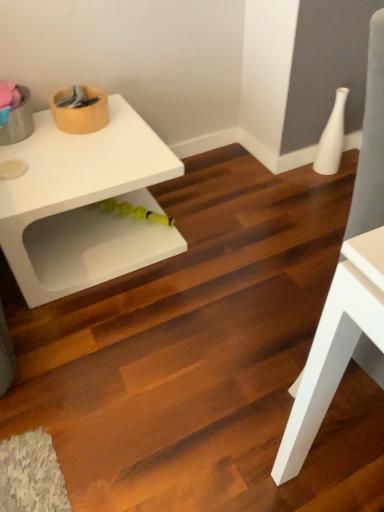
Locate an element on the screen. This screenshot has height=512, width=384. white matte table at right, the second table in the back-to-front sequence is located at coordinates (335, 345).

This screenshot has width=384, height=512. What do you see at coordinates (335, 345) in the screenshot?
I see `white matte table at right, placed as the first table when sorted from front to back` at bounding box center [335, 345].

Locate an element on the screen. The image size is (384, 512). white matte table at right, placed as the first table when sorted from front to back is located at coordinates (335, 345).

Is white glossy vase at upper right wider or thinner than white matte table at right, the second table in the back-to-front sequence?

Clearly, white glossy vase at upper right has less width compared to white matte table at right, the second table in the back-to-front sequence.

Considering the positions of points (333, 119) and (334, 281), is point (333, 119) closer to camera compared to point (334, 281)?

No, it is not.

Can you confirm if white glossy vase at upper right is taller than white matte table at right, the second table in the back-to-front sequence?

Incorrect, the height of white glossy vase at upper right is not larger of that of white matte table at right, the second table in the back-to-front sequence.

Find the location of a particular element. The width and height of the screenshot is (384, 512). table below the white matte table at upper left, the second table when ordered from front to back (from the image's perspective) is located at coordinates (335, 345).

In the image, is white matte table at right, which ranks as the first table in right-to-left order, on the left side or the right side of white matte table at upper left, positioned as the 1th table in back-to-front order?

In the image, white matte table at right, which ranks as the first table in right-to-left order, appears on the right side of white matte table at upper left, positioned as the 1th table in back-to-front order.

Between white matte table at right, placed as the first table when sorted from front to back, and white matte table at upper left, which is the 1th table in left-to-right order, which one has less height?

white matte table at upper left, which is the 1th table in left-to-right order, is shorter.

From the picture: Is white matte table at upper left, the second table when ordered from front to back, inside white matte table at right, which is counted as the second table, starting from the left?

No, white matte table at upper left, the second table when ordered from front to back, is not inside white matte table at right, which is counted as the second table, starting from the left.

Is white matte table at upper left, positioned as the 1th table in back-to-front order, positioned in front of white glossy vase at upper right?

Yes, it is.

Is white matte table at upper left, which is the 1th table in left-to-right order, with white glossy vase at upper right?

white matte table at upper left, which is the 1th table in left-to-right order, is not next to white glossy vase at upper right, and they're not touching.

Considering the points (41, 254) and (328, 169), which point is in front, point (41, 254) or point (328, 169)?

Positioned in front is point (41, 254).

There is a white glossy vase at upper right. Where is `the 1st table above it (from a real-world perspective)`? The width and height of the screenshot is (384, 512). the 1st table above it (from a real-world perspective) is located at coordinates (84, 205).

Does white matte table at upper left, positioned as the 1th table in back-to-front order, come in front of white matte table at right, which ranks as the first table in right-to-left order?

No, it is not.

Can we say white matte table at upper left, which is the 1th table in left-to-right order, lies outside white matte table at right, the second table in the back-to-front sequence?

white matte table at upper left, which is the 1th table in left-to-right order, lies outside white matte table at right, the second table in the back-to-front sequence,'s area.

Considering the sizes of white matte table at upper left, which is the 1th table in left-to-right order, and white matte table at right, the second table in the back-to-front sequence, in the image, is white matte table at upper left, which is the 1th table in left-to-right order, wider or thinner than white matte table at right, the second table in the back-to-front sequence,?

In the image, white matte table at upper left, which is the 1th table in left-to-right order, appears to be wider than white matte table at right, the second table in the back-to-front sequence.

From the image's perspective, which one is positioned higher, white glossy vase at upper right or white matte table at upper left, which is the second table from right to left?

white glossy vase at upper right appears higher in the image.

Is white glossy vase at upper right not near white matte table at upper left, positioned as the 1th table in back-to-front order?

Yes, white glossy vase at upper right and white matte table at upper left, positioned as the 1th table in back-to-front order, are located far from each other.

Which of these two, white glossy vase at upper right or white matte table at upper left, the second table when ordered from front to back, is thinner?

Thinner between the two is white glossy vase at upper right.

In the image, is white glossy vase at upper right positioned in front of or behind white matte table at upper left, which is the second table from right to left?

white glossy vase at upper right is behind white matte table at upper left, which is the second table from right to left.

Considering the sizes of objects white matte table at right, placed as the first table when sorted from front to back, and white glossy vase at upper right in the image provided, who is taller, white matte table at right, placed as the first table when sorted from front to back, or white glossy vase at upper right?

white matte table at right, placed as the first table when sorted from front to back, is taller.

Which of these two, white matte table at right, placed as the first table when sorted from front to back, or white glossy vase at upper right, is wider?

With larger width is white matte table at right, placed as the first table when sorted from front to back.

Considering the relative sizes of white matte table at right, the second table in the back-to-front sequence, and white glossy vase at upper right in the image provided, is white matte table at right, the second table in the back-to-front sequence, bigger than white glossy vase at upper right?

Yes.

Is white glossy vase at upper right located within white matte table at right, placed as the first table when sorted from front to back?

No, white glossy vase at upper right is not inside white matte table at right, placed as the first table when sorted from front to back.

From a real-world perspective, count 2nd tables upward from the white glossy vase at upper right and point to it. Please provide its 2D coordinates.

[(335, 345)]

Where is `table below the white matte table at right, placed as the first table when sorted from front to back (from a real-world perspective)`? The image size is (384, 512). table below the white matte table at right, placed as the first table when sorted from front to back (from a real-world perspective) is located at coordinates (84, 205).

Looking at the image, which one is located further to white glossy vase at upper right, white matte table at upper left, the second table when ordered from front to back, or white matte table at right, placed as the first table when sorted from front to back?

Based on the image, white matte table at right, placed as the first table when sorted from front to back, appears to be further to white glossy vase at upper right.

When comparing their distances from white matte table at right, which is counted as the second table, starting from the left, does white glossy vase at upper right or white matte table at upper left, which is the second table from right to left, seem further?

Among the two, white glossy vase at upper right is located further to white matte table at right, which is counted as the second table, starting from the left.

Estimate the real-world distances between objects in this image. Which object is further from white glossy vase at upper right, white matte table at right, which is counted as the second table, starting from the left, or white matte table at upper left, the second table when ordered from front to back?

white matte table at right, which is counted as the second table, starting from the left.

Considering their positions, is white matte table at upper left, positioned as the 1th table in back-to-front order, positioned closer to white matte table at right, placed as the first table when sorted from front to back, than white glossy vase at upper right?

The object closer to white matte table at right, placed as the first table when sorted from front to back, is white matte table at upper left, positioned as the 1th table in back-to-front order.

When comparing their distances from white matte table at upper left, the second table when ordered from front to back, does white glossy vase at upper right or white matte table at right, which is counted as the second table, starting from the left, seem closer?

Based on the image, white matte table at right, which is counted as the second table, starting from the left, appears to be nearer to white matte table at upper left, the second table when ordered from front to back.

Considering their positions, is white matte table at right, which ranks as the first table in right-to-left order, positioned further to white matte table at upper left, which is the 1th table in left-to-right order, than white glossy vase at upper right?

white glossy vase at upper right.

Locate an element on the screen. This screenshot has width=384, height=512. table between white matte table at right, which is counted as the second table, starting from the left, and white glossy vase at upper right in the front-back direction is located at coordinates (84, 205).